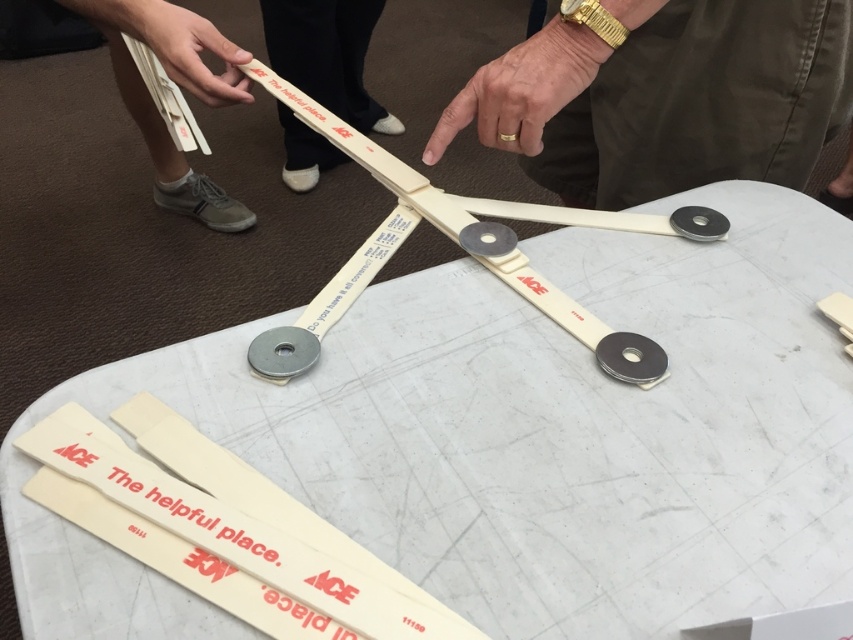
You are a customer at the hardware store and see the white plastic table at center and the gold metallic watch at upper center. Which object is wider?

The white plastic table at center is wider than the gold metallic watch at upper center.

You are a robot trying to assemble the device shown in the image. You need to determine which of the two points, point (370, 435) or point (471, 112), is closer to you. Which one should you choose?

Point (370, 435) is closer to the viewer than point (471, 112), so you should choose point (370, 435).

You are a robot trying to assemble a device on the table. The white plastic table at center is where you need to place parts. However, your arm is currently at the position of the matte white hand at upper left. Can you safely lower your arm to the table without hitting anything?

Yes, the white plastic table at center is positioned under matte white hand at upper left, so lowering the arm directly downward would reach the table without obstruction.